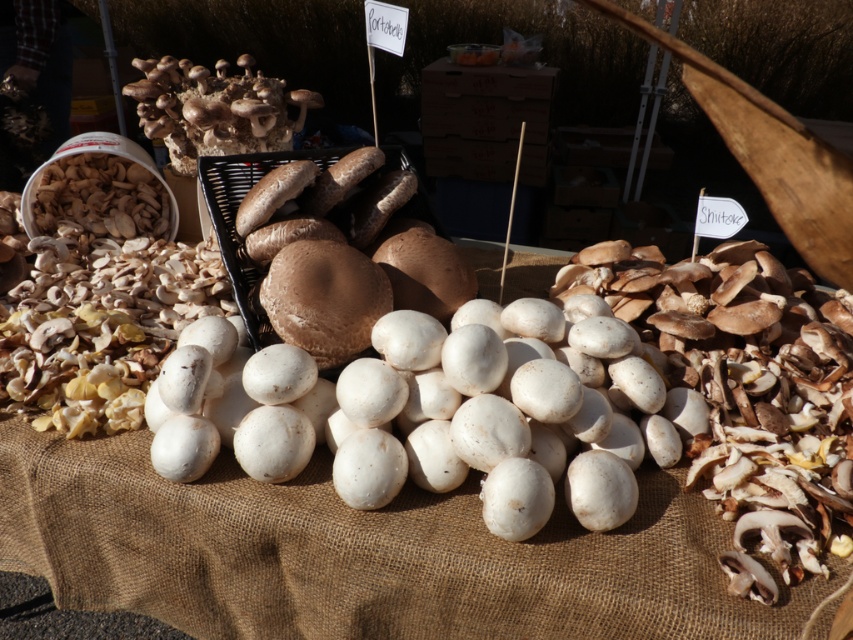
Is brown matte mushrooms at center to the right of brown fuzzy mushrooms at upper left from the viewer's perspective?

Indeed, brown matte mushrooms at center is positioned on the right side of brown fuzzy mushrooms at upper left.

Can you confirm if brown matte mushrooms at center is taller than brown fuzzy mushrooms at upper left?

Correct, brown matte mushrooms at center is much taller as brown fuzzy mushrooms at upper left.

Is point (335, 269) closer to viewer compared to point (178, 84)?

Yes, point (335, 269) is closer to viewer.

I want to click on brown matte mushrooms at center, so click(363, 275).